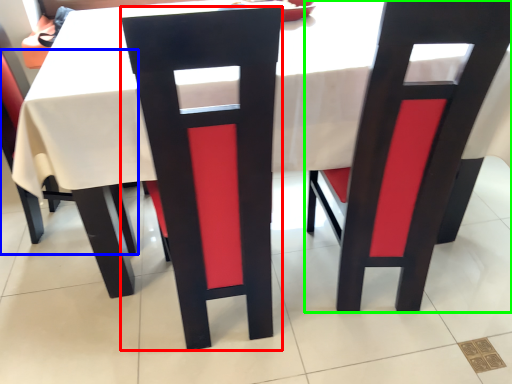
Question: Estimate the real-world distances between objects in this image. Which object is closer to chair (highlighted by a red box), chair (highlighted by a blue box) or chair (highlighted by a green box)?

Choices:
 (A) chair
 (B) chair

Answer: (B)